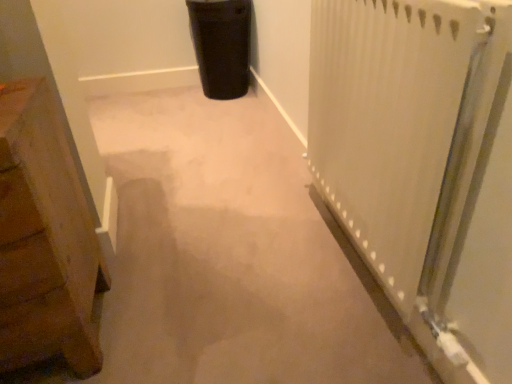
Question: Is white textured radiator at right positioned with its back to black matte trash can at upper center?

Choices:
 (A) no
 (B) yes

Answer: (A)

Question: Can you confirm if white textured radiator at right is positioned to the left of black matte trash can at upper center?

Choices:
 (A) no
 (B) yes

Answer: (A)

Question: From the image's perspective, is white textured radiator at right over black matte trash can at upper center?

Choices:
 (A) no
 (B) yes

Answer: (A)

Question: Is black matte trash can at upper center completely or partially inside white textured radiator at right?

Choices:
 (A) yes
 (B) no

Answer: (B)

Question: Does white textured radiator at right appear on the right side of black matte trash can at upper center?

Choices:
 (A) no
 (B) yes

Answer: (B)

Question: From the image's perspective, relative to wooden chest at left, is black matte trash can at upper center above or below?

Choices:
 (A) above
 (B) below

Answer: (A)

Question: Considering the relative positions of black matte trash can at upper center and wooden chest at left in the image provided, is black matte trash can at upper center to the left or to the right of wooden chest at left?

Choices:
 (A) right
 (B) left

Answer: (A)

Question: Relative to wooden chest at left, is black matte trash can at upper center in front or behind?

Choices:
 (A) front
 (B) behind

Answer: (B)

Question: In terms of width, does black matte trash can at upper center look wider or thinner when compared to wooden chest at left?

Choices:
 (A) thin
 (B) wide

Answer: (A)

Question: Based on their positions, is wooden chest at left located to the left or right of black matte trash can at upper center?

Choices:
 (A) right
 (B) left

Answer: (B)

Question: Is wooden chest at left in front of or behind black matte trash can at upper center in the image?

Choices:
 (A) behind
 (B) front

Answer: (B)

Question: From the image's perspective, is wooden chest at left positioned above or below black matte trash can at upper center?

Choices:
 (A) above
 (B) below

Answer: (B)

Question: Considering the positions of wooden chest at left and black matte trash can at upper center in the image, is wooden chest at left bigger or smaller than black matte trash can at upper center?

Choices:
 (A) small
 (B) big

Answer: (B)

Question: Looking at the image, does white textured radiator at right seem bigger or smaller compared to black matte trash can at upper center?

Choices:
 (A) big
 (B) small

Answer: (B)

Question: From the image's perspective, relative to black matte trash can at upper center, is white textured radiator at right above or below?

Choices:
 (A) below
 (B) above

Answer: (A)